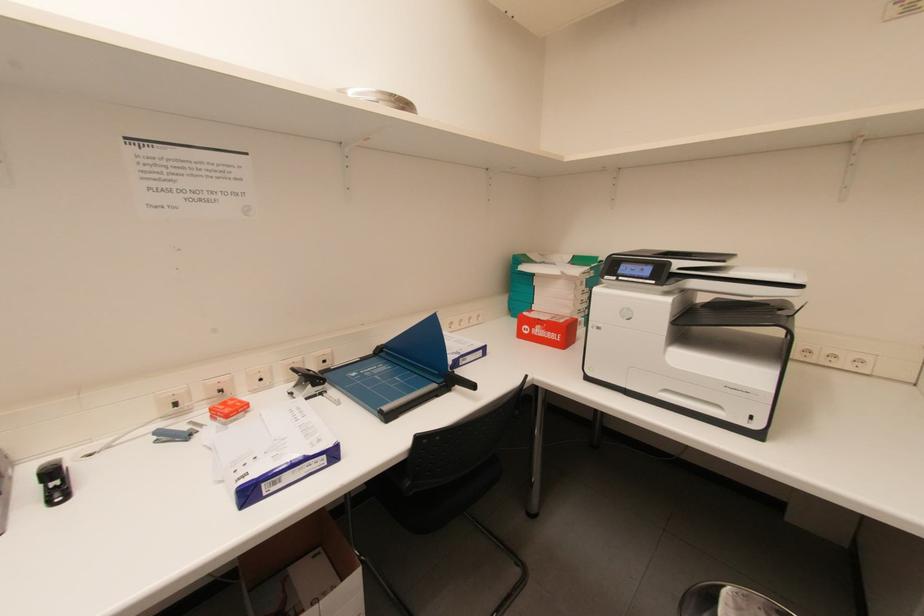
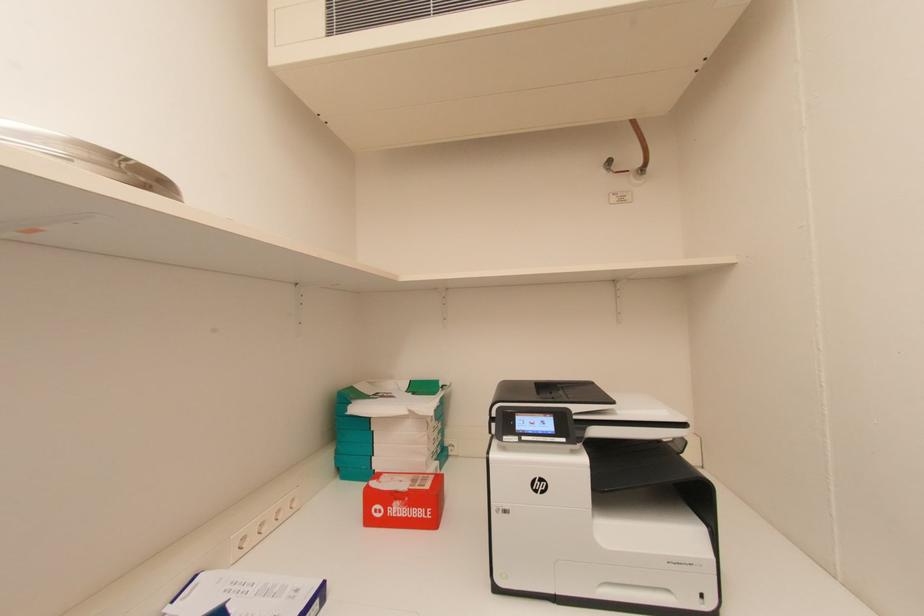
Question: Based on the continuous images, in which direction is the camera rotating? Reply with the corresponding letter.

Choices:
 (A) Left
 (B) Right
 (C) Up
 (D) Down

Answer: (B)